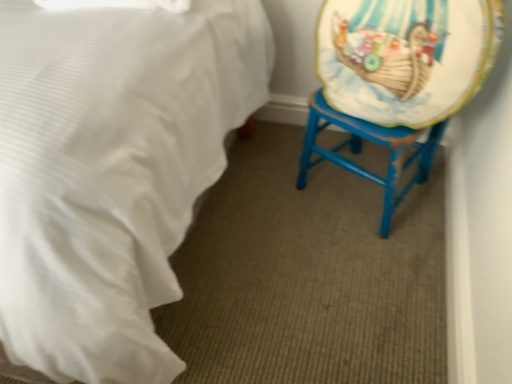
What is the approximate width of white satin bed at lower left?

4.20 feet.

At what (x,y) coordinates should I click in order to perform the action: click on white satin bed at lower left. Please return your answer as a coordinate pair (x, y). The width and height of the screenshot is (512, 384). Looking at the image, I should click on (112, 173).

At what (x,y) coordinates should I click in order to perform the action: click on matte plastic platter at right. Please return your answer as a coordinate pair (x, y). Looking at the image, I should click on (405, 56).

Looking at this image, what is the approximate height of blue painted wood swivel chair at right?

26.32 inches.

Where is `white satin bed at lower left`? white satin bed at lower left is located at coordinates (112, 173).

From the image's perspective, is matte plastic platter at right above or below blue painted wood swivel chair at right?

Clearly, from the image's perspective, matte plastic platter at right is above blue painted wood swivel chair at right.

Is matte plastic platter at right far from blue painted wood swivel chair at right?

They are positioned close to each other.

From the picture: Is matte plastic platter at right to the left of blue painted wood swivel chair at right from the viewer's perspective?

Yes, matte plastic platter at right is to the left of blue painted wood swivel chair at right.

Who is smaller, white satin bed at lower left or blue painted wood swivel chair at right?

With smaller size is blue painted wood swivel chair at right.

Could you tell me if white satin bed at lower left is facing blue painted wood swivel chair at right?

Yes, white satin bed at lower left is aimed at blue painted wood swivel chair at right.

Looking at their sizes, would you say white satin bed at lower left is wider or thinner than blue painted wood swivel chair at right?

Considering their sizes, white satin bed at lower left looks broader than blue painted wood swivel chair at right.

Is point (8, 200) closer or farther from the camera than point (368, 127)?

Point (8, 200).

Considering the sizes of objects blue painted wood swivel chair at right and matte plastic platter at right in the image provided, who is taller, blue painted wood swivel chair at right or matte plastic platter at right?

blue painted wood swivel chair at right is taller.

Between point (387, 39) and point (477, 54), which one is positioned behind?

Point (387, 39)

You are a GUI agent. You are given a task and a screenshot of the screen. Output one action in this format:
    pyautogui.click(x=<x>, y=<y>)
    Task: Click on the swivel chair below the matte plastic platter at right (from a real-world perspective)
    The image size is (512, 384).
    Given the screenshot: What is the action you would take?
    pyautogui.click(x=398, y=79)

From the picture: From the image's perspective, is blue painted wood swivel chair at right over white satin bed at lower left?

No, from the image's perspective, blue painted wood swivel chair at right is not above white satin bed at lower left.

Is blue painted wood swivel chair at right smaller than white satin bed at lower left?

Yes, blue painted wood swivel chair at right is smaller than white satin bed at lower left.

Is blue painted wood swivel chair at right in front of or behind white satin bed at lower left in the image?

In the image, blue painted wood swivel chair at right appears behind white satin bed at lower left.

Is point (399, 70) closer to camera compared to point (101, 223)?

No, (399, 70) is behind (101, 223).

From a real-world perspective, is white satin bed at lower left under matte plastic platter at right?

Yes, from a real-world perspective, white satin bed at lower left is beneath matte plastic platter at right.

From the image's perspective, is white satin bed at lower left under matte plastic platter at right?

Indeed, from the image's perspective, white satin bed at lower left is shown beneath matte plastic platter at right.

How different are the orientations of white satin bed at lower left and matte plastic platter at right in degrees?

white satin bed at lower left and matte plastic platter at right are facing 116 degrees away from each other.

Could you tell me if white satin bed at lower left is turned towards matte plastic platter at right?

Yes, white satin bed at lower left faces towards matte plastic platter at right.

Where is `bed beneath the matte plastic platter at right (from a real-world perspective)`? Image resolution: width=512 pixels, height=384 pixels. bed beneath the matte plastic platter at right (from a real-world perspective) is located at coordinates (112, 173).

Between matte plastic platter at right and white satin bed at lower left, which one appears on the left side from the viewer's perspective?

A: Positioned to the left is white satin bed at lower left.

The image size is (512, 384). What are the coordinates of `platter above the blue painted wood swivel chair at right (from a real-world perspective)` in the screenshot? It's located at (405, 56).

Find the location of a particular element. Image resolution: width=512 pixels, height=384 pixels. swivel chair below the white satin bed at lower left (from a real-world perspective) is located at coordinates (398, 79).

Which object lies nearer to the anchor point white satin bed at lower left, blue painted wood swivel chair at right or matte plastic platter at right?

blue painted wood swivel chair at right.

Looking at the image, which one is located further to blue painted wood swivel chair at right, matte plastic platter at right or white satin bed at lower left?

white satin bed at lower left is positioned further to the anchor blue painted wood swivel chair at right.

From the picture: Which object lies further to the anchor point white satin bed at lower left, matte plastic platter at right or blue painted wood swivel chair at right?

matte plastic platter at right lies further to white satin bed at lower left than the other object.

Which object lies further to the anchor point matte plastic platter at right, blue painted wood swivel chair at right or white satin bed at lower left?

white satin bed at lower left is positioned further to the anchor matte plastic platter at right.

Based on their spatial positions, is white satin bed at lower left or blue painted wood swivel chair at right closer to matte plastic platter at right?

The object closer to matte plastic platter at right is blue painted wood swivel chair at right.

Which object lies further to the anchor point blue painted wood swivel chair at right, white satin bed at lower left or matte plastic platter at right?

white satin bed at lower left.

At what (x,y) coordinates should I click in order to perform the action: click on platter situated between white satin bed at lower left and blue painted wood swivel chair at right from left to right. Please return your answer as a coordinate pair (x, y). The height and width of the screenshot is (384, 512). Looking at the image, I should click on (405, 56).